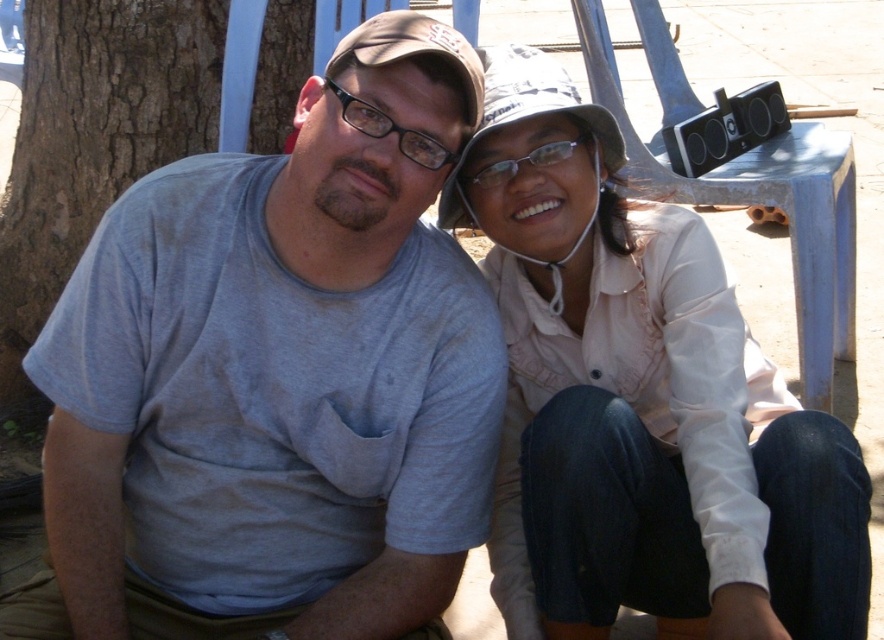
Which of these two, gray cotton t-shirt at left or brown fabric baseball hat at center, stands taller?

gray cotton t-shirt at left is taller.

Is gray cotton t-shirt at left smaller than brown fabric baseball hat at center?

Incorrect, gray cotton t-shirt at left is not smaller in size than brown fabric baseball hat at center.

Which is behind, point (345, 58) or point (481, 128)?

The point (481, 128) is behind.

Image resolution: width=884 pixels, height=640 pixels. Identify the location of gray cotton t-shirt at left. (277, 378).

Can you confirm if brown rough bark at left is shorter than clear plastic glasses at center?

No, brown rough bark at left is not shorter than clear plastic glasses at center.

Does point (8, 362) come closer to viewer compared to point (524, 163)?

No, (8, 362) is further to viewer.

Is point (280, 86) farther from viewer compared to point (562, 141)?

Yes, it is.

Locate an element on the screen. This screenshot has width=884, height=640. brown rough bark at left is located at coordinates (93, 141).

Is point (424, 177) less distant than point (555, 156)?

Yes, point (424, 177) is in front of point (555, 156).

Who is more forward, [309,305] or [549,145]?

Point [309,305] is in front.

At what (x,y) coordinates should I click in order to perform the action: click on gray cotton t-shirt at left. Please return your answer as a coordinate pair (x, y). This screenshot has height=640, width=884. Looking at the image, I should click on (277, 378).